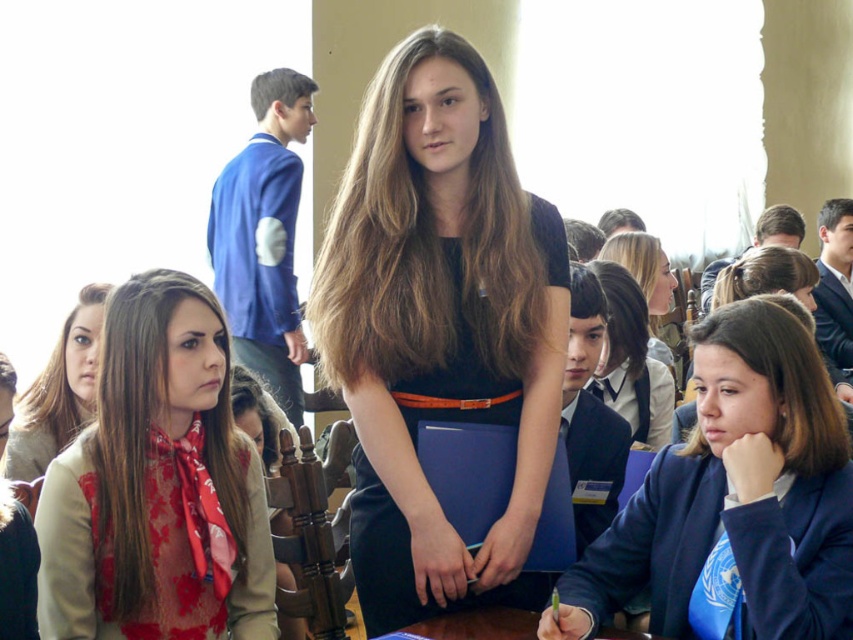
Is the position of black matte dress at center less distant than that of matte black dress at center?

That is True.

Based on the photo, which of these two, black matte dress at center or matte black dress at center, stands shorter?

Standing shorter between the two is matte black dress at center.

What are the coordinates of `black matte dress at center` in the screenshot? It's located at (439, 326).

Who is lower down, black matte dress at center or matte beige scarf at left?

Positioned lower is matte beige scarf at left.

Does point (535, 196) lie in front of point (64, 403)?

No, (535, 196) is behind (64, 403).

Measure the distance between point (409, 588) and camera.

20.10 meters

You are a GUI agent. You are given a task and a screenshot of the screen. Output one action in this format:
    pyautogui.click(x=<x>, y=<y>)
    Task: Click on the black matte dress at center
    This screenshot has width=853, height=640.
    Given the screenshot: What is the action you would take?
    (x=439, y=326)

Which is behind, point (492, 333) or point (21, 524)?

Point (492, 333)

Does black matte dress at center have a greater width compared to light brown hair at lower left?

Indeed, black matte dress at center has a greater width compared to light brown hair at lower left.

Image resolution: width=853 pixels, height=640 pixels. What do you see at coordinates (439, 326) in the screenshot?
I see `black matte dress at center` at bounding box center [439, 326].

Image resolution: width=853 pixels, height=640 pixels. Find the location of `black matte dress at center`. black matte dress at center is located at coordinates (439, 326).